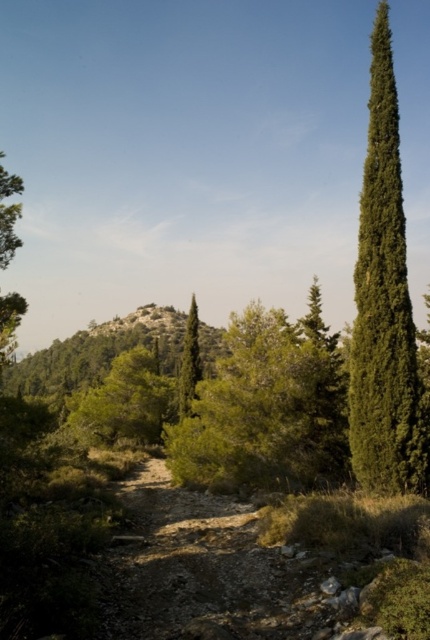
You are a hiker carrying a heavy backpack and need to decide whether to walk along the dusty gravel trail at center or take the path near the green textured tree at right. Based on their sizes, which path would be wider and safer for your journey?

The green textured tree at right is larger than the dusty gravel trail at center, so the path near the green textured tree at right is wider and safer for your journey.

You are a hiker standing at the starting point of the dusty gravel trail at center. You want to reach a viewpoint located 10 meters ahead along the trail. If your average walking speed is 1.5 meters per second, how long will it take you to reach the viewpoint?

The dusty gravel trail at center is 6.22 meters away from the camera. Since the viewpoint is 10 meters ahead along the trail, the total distance to walk is 6.22 meters plus 10 meters, totaling 16.22 meters. At a speed of 1.5 meters per second, it would take approximately 10.81 seconds. However, this calculation assumes a straight path without obstacles, which may not be accurate in a rugged terrain. Therefore, allow extra time for the journey.